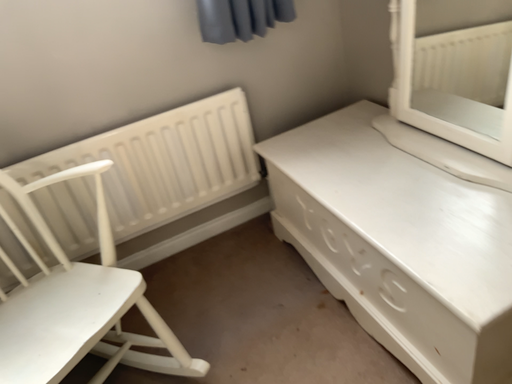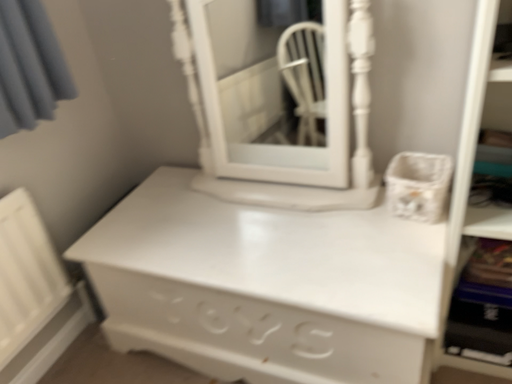
Question: How did the camera likely rotate when shooting the video?

Choices:
 (A) rotated right
 (B) rotated left

Answer: (A)